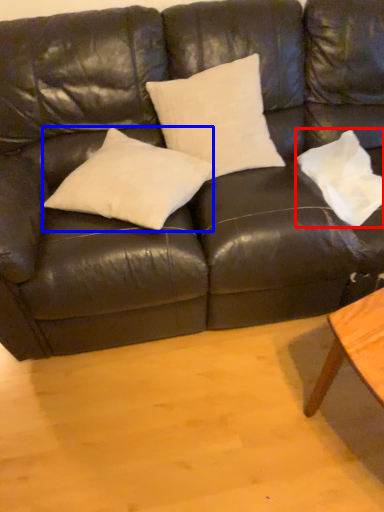
Question: Which of the following is the farthest to the observer, pillow (highlighted by a red box) or pillow (highlighted by a blue box)?

Choices:
 (A) pillow
 (B) pillow

Answer: (A)